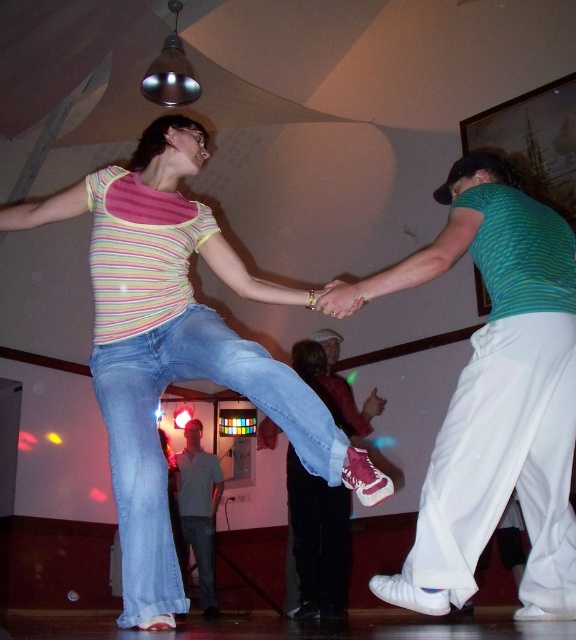
Does matte green shirt at right lie in front of light blue jeans at lower center?

Yes, matte green shirt at right is closer to the viewer.

Between matte green shirt at right and light blue jeans at lower center, which one has less height?

light blue jeans at lower center

Does point (422, 596) come farther from viewer compared to point (190, 477)?

No.

Identify the location of matte green shirt at right. (494, 397).

Can you confirm if blue denim jeans at center is positioned below light blue jeans at lower center?

Incorrect, blue denim jeans at center is not positioned below light blue jeans at lower center.

Between blue denim jeans at center and light blue jeans at lower center, which one appears on the left side from the viewer's perspective?

From the viewer's perspective, light blue jeans at lower center appears more on the left side.

Is point (115, 413) closer to viewer compared to point (190, 461)?

Yes, it is.

Identify the location of blue denim jeans at center. (158, 444).

Can you confirm if striped cotton shirt at center is positioned below blue denim jeans at center?

No, striped cotton shirt at center is not below blue denim jeans at center.

Consider the image. Is striped cotton shirt at center closer to the viewer compared to blue denim jeans at center?

Yes, it is in front of blue denim jeans at center.

Which is behind, point (169, 592) or point (146, 349)?

Point (146, 349)

Locate an element on the screen. The height and width of the screenshot is (640, 576). striped cotton shirt at center is located at coordinates (176, 348).